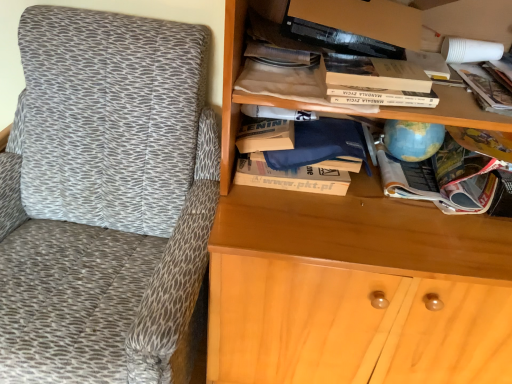
Question: Can you confirm if multicolored paper magazine at center right, which is counted as the third book, starting from the left, is wider than hardcover book at upper center?

Choices:
 (A) no
 (B) yes

Answer: (B)

Question: Is multicolored paper magazine at center right, which is counted as the third book, starting from the left, bigger than hardcover book at upper center?

Choices:
 (A) no
 (B) yes

Answer: (B)

Question: Is multicolored paper magazine at center right, which is counted as the third book, starting from the left, not close to hardcover book at upper center?

Choices:
 (A) yes
 (B) no

Answer: (B)

Question: Is multicolored paper magazine at center right, which is counted as the third book, starting from the left, further to camera compared to hardcover book at upper center?

Choices:
 (A) no
 (B) yes

Answer: (B)

Question: Are multicolored paper magazine at center right, which is counted as the third book, starting from the left, and hardcover book at upper center making contact?

Choices:
 (A) no
 (B) yes

Answer: (A)

Question: Is wooden bookshelf at upper right inside or outside of multicolored paper magazine at center right, which is counted as the third book, starting from the left?

Choices:
 (A) outside
 (B) inside

Answer: (A)

Question: Considering the positions of wooden bookshelf at upper right and multicolored paper magazine at center right, which appears as the 1th book when viewed from the right, in the image, is wooden bookshelf at upper right bigger or smaller than multicolored paper magazine at center right, which appears as the 1th book when viewed from the right,?

Choices:
 (A) big
 (B) small

Answer: (A)

Question: Is point (483, 114) positioned closer to the camera than point (446, 142)?

Choices:
 (A) closer
 (B) farther

Answer: (A)

Question: Is wooden bookshelf at upper right wider or thinner than multicolored paper magazine at center right, which is counted as the third book, starting from the left?

Choices:
 (A) thin
 (B) wide

Answer: (A)

Question: From a real-world perspective, is multicolored paper magazine at center right, which appears as the 1th book when viewed from the right, positioned above or below hardcover book at upper center?

Choices:
 (A) above
 (B) below

Answer: (B)

Question: Is multicolored paper magazine at center right, which appears as the 1th book when viewed from the right, taller or shorter than hardcover book at upper center?

Choices:
 (A) tall
 (B) short

Answer: (A)

Question: Is multicolored paper magazine at center right, which is counted as the third book, starting from the left, inside or outside of hardcover book at upper center?

Choices:
 (A) inside
 (B) outside

Answer: (B)

Question: Considering the positions of multicolored paper magazine at center right, which appears as the 1th book when viewed from the right, and hardcover book at upper center in the image, is multicolored paper magazine at center right, which appears as the 1th book when viewed from the right, bigger or smaller than hardcover book at upper center?

Choices:
 (A) big
 (B) small

Answer: (A)

Question: Is multicolored paper magazine at center right, which is counted as the third book, starting from the left, inside or outside of textured fabric chair at left?

Choices:
 (A) outside
 (B) inside

Answer: (A)

Question: In the image, is multicolored paper magazine at center right, which appears as the 1th book when viewed from the right, positioned in front of or behind textured fabric chair at left?

Choices:
 (A) front
 (B) behind

Answer: (B)